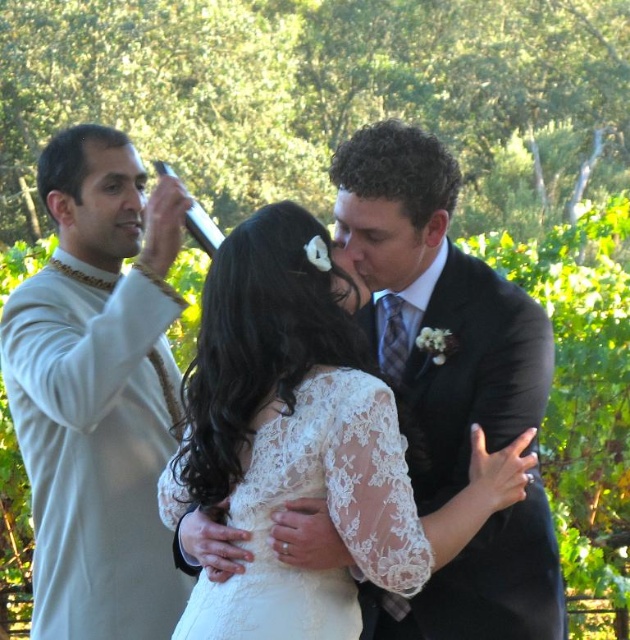
Question: Which object is positioned farthest from the lace/embroidered dress at center?

Choices:
 (A) white lace dress at center
 (B) shiny black suit at center
 (C) white textured sweater at left

Answer: (C)

Question: Observing the image, what is the correct spatial positioning of white textured sweater at left in reference to white lace dress at center?

Choices:
 (A) left
 (B) right

Answer: (A)

Question: Among these objects, which one is nearest to the camera?

Choices:
 (A) lace/embroidered dress at center
 (B) white lace dress at center
 (C) shiny black suit at center
 (D) white textured sweater at left

Answer: (A)

Question: Does white textured sweater at left appear over white lace dress at center?

Choices:
 (A) yes
 (B) no

Answer: (A)

Question: Which point is farther from the camera taking this photo?

Choices:
 (A) (161, 435)
 (B) (379, 579)

Answer: (A)

Question: Can you confirm if white textured sweater at left is positioned to the right of shiny black suit at center?

Choices:
 (A) no
 (B) yes

Answer: (A)